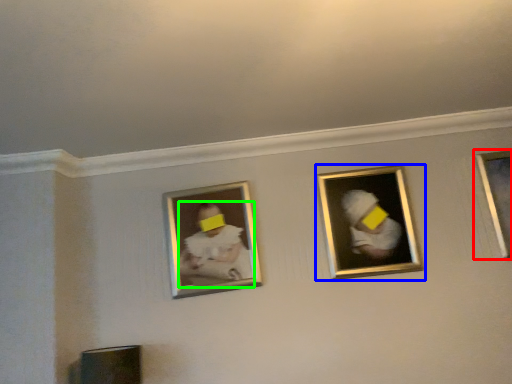
Question: Which object is positioned closest to picture frame (highlighted by a red box)? Select from picture frame (highlighted by a blue box) and person (highlighted by a green box).

Choices:
 (A) picture frame
 (B) person

Answer: (A)